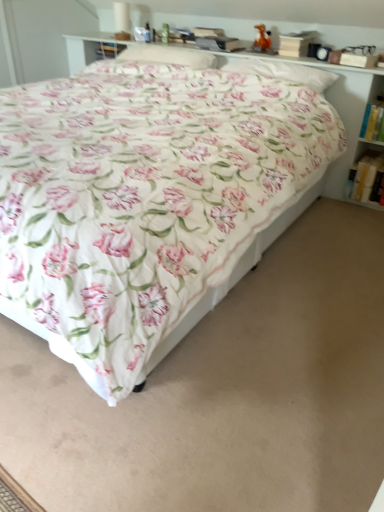
Question: Considering the relative sizes of white soft pillow at upper center, the first pillow in the left-to-right sequence, and floral fabric pillow at upper center, arranged as the second pillow when viewed from the left, in the image provided, is white soft pillow at upper center, the first pillow in the left-to-right sequence, taller than floral fabric pillow at upper center, arranged as the second pillow when viewed from the left,?

Choices:
 (A) yes
 (B) no

Answer: (A)

Question: Is white soft pillow at upper center, the 2th pillow positioned from the right, shorter than floral fabric pillow at upper center, the first pillow in the right-to-left sequence?

Choices:
 (A) no
 (B) yes

Answer: (A)

Question: From a real-world perspective, is white soft pillow at upper center, the first pillow in the left-to-right sequence, physically above floral fabric pillow at upper center, the first pillow in the right-to-left sequence?

Choices:
 (A) yes
 (B) no

Answer: (A)

Question: From a real-world perspective, is white soft pillow at upper center, the first pillow in the left-to-right sequence, below floral fabric pillow at upper center, arranged as the second pillow when viewed from the left?

Choices:
 (A) no
 (B) yes

Answer: (A)

Question: Can you see white soft pillow at upper center, the 2th pillow positioned from the right, touching floral fabric pillow at upper center, the first pillow in the right-to-left sequence?

Choices:
 (A) yes
 (B) no

Answer: (B)

Question: Based on their sizes in the image, would you say floral cotton bed at center is bigger or smaller than white soft pillow at upper center, the 2th pillow positioned from the right?

Choices:
 (A) big
 (B) small

Answer: (A)

Question: From a real-world perspective, is floral cotton bed at center above or below white soft pillow at upper center, the first pillow in the left-to-right sequence?

Choices:
 (A) above
 (B) below

Answer: (B)

Question: Relative to white soft pillow at upper center, the 2th pillow positioned from the right, is floral cotton bed at center in front or behind?

Choices:
 (A) front
 (B) behind

Answer: (A)

Question: From the image's perspective, is floral cotton bed at center above or below white soft pillow at upper center, the 2th pillow positioned from the right?

Choices:
 (A) below
 (B) above

Answer: (A)

Question: Is point (380, 110) positioned closer to the camera than point (168, 315)?

Choices:
 (A) closer
 (B) farther

Answer: (B)

Question: Considering the positions of white paper book at right, acting as the 2th book starting from the bottom, and floral cotton bed at center in the image, is white paper book at right, acting as the 2th book starting from the bottom, taller or shorter than floral cotton bed at center?

Choices:
 (A) short
 (B) tall

Answer: (A)

Question: In the image, is white paper book at right, acting as the 2th book starting from the bottom, positioned in front of or behind floral cotton bed at center?

Choices:
 (A) behind
 (B) front

Answer: (A)

Question: Is white paper book at right, acting as the 2th book starting from the bottom, bigger or smaller than floral cotton bed at center?

Choices:
 (A) big
 (B) small

Answer: (B)

Question: From a real-world perspective, relative to white paper book at right, placed as the second book when sorted from top to bottom, is white soft pillow at upper center, the first pillow in the left-to-right sequence, vertically above or below?

Choices:
 (A) above
 (B) below

Answer: (A)

Question: Which is correct: white soft pillow at upper center, the 2th pillow positioned from the right, is inside white paper book at right, placed as the second book when sorted from top to bottom, or outside of it?

Choices:
 (A) inside
 (B) outside

Answer: (B)